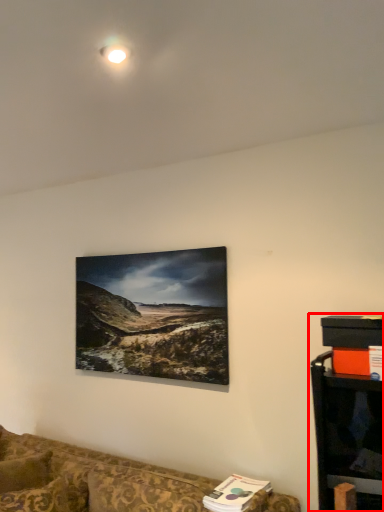
Question: Considering the relative positions of entertainment center (annotated by the red box) and studio couch in the image provided, where is entertainment center (annotated by the red box) located with respect to the staircase?

Choices:
 (A) right
 (B) left

Answer: (A)